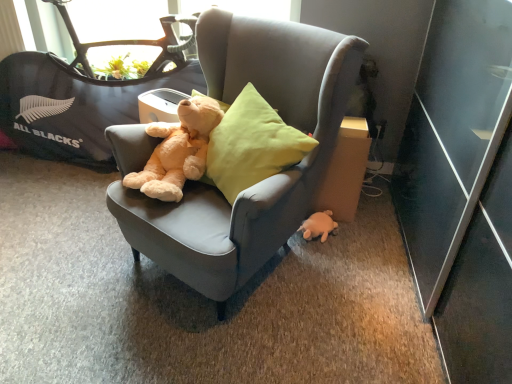
Identify the location of vacant area that lies in front of black fabric baby carriage at upper left. Image resolution: width=512 pixels, height=384 pixels. 84,277.